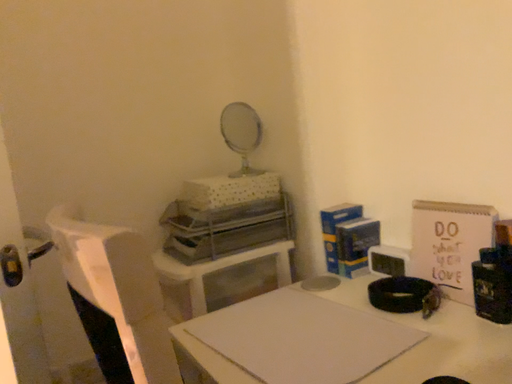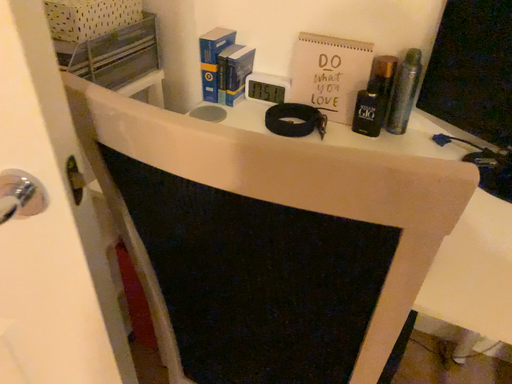
Question: How did the camera likely rotate when shooting the video?

Choices:
 (A) rotated upward
 (B) rotated downward

Answer: (B)